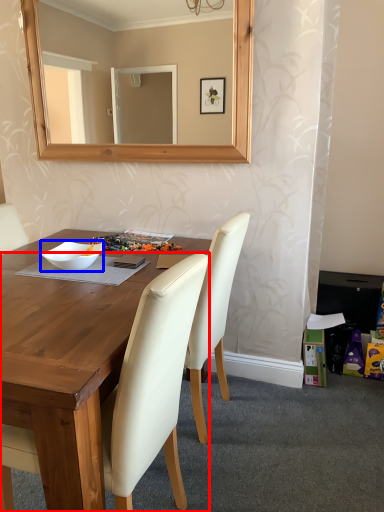
Question: Among these objects, which one is farthest to the camera, chair (highlighted by a red box) or bowl (highlighted by a blue box)?

Choices:
 (A) chair
 (B) bowl

Answer: (B)